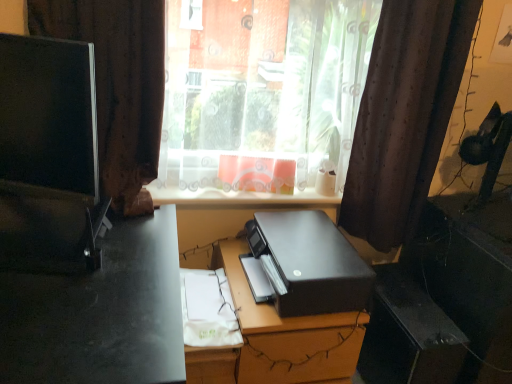
Question: Should I look upward or downward to see black plastic file cabinet at center?

Choices:
 (A) down
 (B) up

Answer: (A)

Question: Is transparent plastic window at center smaller than black matte printer at center?

Choices:
 (A) no
 (B) yes

Answer: (B)

Question: From a real-world perspective, is transparent plastic window at center beneath black matte printer at center?

Choices:
 (A) yes
 (B) no

Answer: (B)

Question: Can you confirm if transparent plastic window at center is positioned to the left of black matte printer at center?

Choices:
 (A) yes
 (B) no

Answer: (B)

Question: Is the depth of transparent plastic window at center less than that of black matte printer at center?

Choices:
 (A) yes
 (B) no

Answer: (B)

Question: Considering the relative positions of transparent plastic window at center and black matte printer at center in the image provided, is transparent plastic window at center to the right of black matte printer at center from the viewer's perspective?

Choices:
 (A) no
 (B) yes

Answer: (B)

Question: Is the position of transparent plastic window at center more distant than that of black matte printer at center?

Choices:
 (A) yes
 (B) no

Answer: (A)

Question: Does black plastic file cabinet at center have a larger size compared to brown sheer curtain at right, acting as the first curtain starting from the right?

Choices:
 (A) yes
 (B) no

Answer: (B)

Question: Considering the relative sizes of black plastic file cabinet at center and brown sheer curtain at right, placed as the second curtain when sorted from left to right, in the image provided, is black plastic file cabinet at center shorter than brown sheer curtain at right, placed as the second curtain when sorted from left to right,?

Choices:
 (A) yes
 (B) no

Answer: (A)

Question: Is black plastic file cabinet at center wider than brown sheer curtain at right, placed as the second curtain when sorted from left to right?

Choices:
 (A) yes
 (B) no

Answer: (A)

Question: Can you see black plastic file cabinet at center touching brown sheer curtain at right, placed as the second curtain when sorted from left to right?

Choices:
 (A) yes
 (B) no

Answer: (B)

Question: Does black plastic file cabinet at center lie in front of brown sheer curtain at right, acting as the first curtain starting from the right?

Choices:
 (A) yes
 (B) no

Answer: (B)

Question: Can you confirm if black plastic file cabinet at center is taller than brown sheer curtain at right, placed as the second curtain when sorted from left to right?

Choices:
 (A) yes
 (B) no

Answer: (B)

Question: From a real-world perspective, is black plastic file cabinet at center positioned under brown fabric curtain at left, which appears as the 1th curtain when viewed from the left, based on gravity?

Choices:
 (A) yes
 (B) no

Answer: (A)